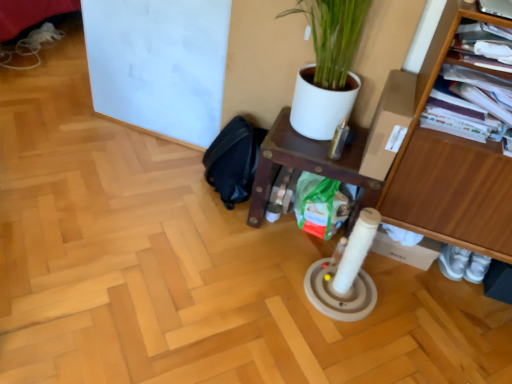
Locate an element on the screen. vacant space in front of wooden shelf at right is located at coordinates (430, 332).